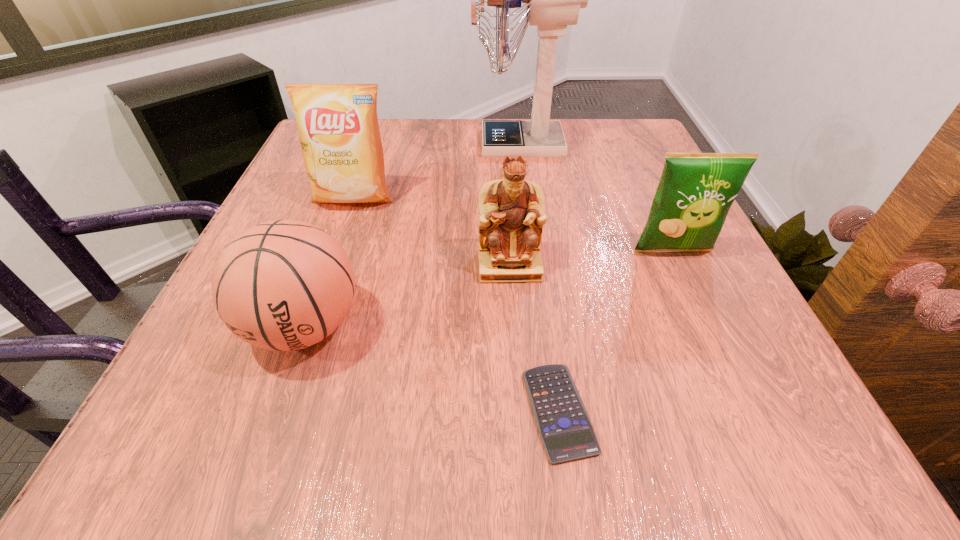
Locate an element on the screen. The image size is (960, 540). vacant position in the image that satisfies the following two spatial constraints: 1. on the front-facing side of the farthest object; 2. on the front-facing side of the figurine is located at coordinates tap(535, 265).